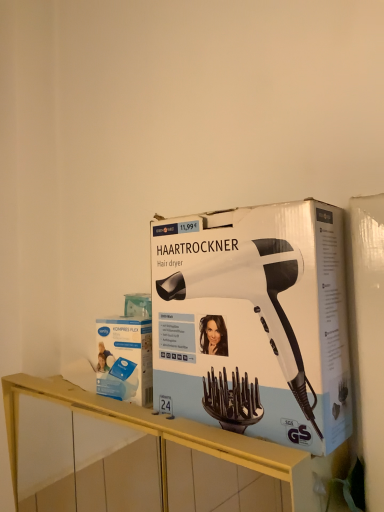
Question: Does yellow wood shelf at center touch white/black plastic hair dryer at center?

Choices:
 (A) yes
 (B) no

Answer: (B)

Question: Can we say yellow wood shelf at center lies outside white/black plastic hair dryer at center?

Choices:
 (A) no
 (B) yes

Answer: (B)

Question: Can you confirm if yellow wood shelf at center is positioned to the right of white/black plastic hair dryer at center?

Choices:
 (A) yes
 (B) no

Answer: (B)

Question: Is the depth of yellow wood shelf at center greater than that of white/black plastic hair dryer at center?

Choices:
 (A) yes
 (B) no

Answer: (B)

Question: Does yellow wood shelf at center have a greater height compared to white/black plastic hair dryer at center?

Choices:
 (A) no
 (B) yes

Answer: (B)

Question: Is white/black plastic hair dryer at center at the back of yellow wood shelf at center?

Choices:
 (A) no
 (B) yes

Answer: (A)

Question: Are white/black plastic hair dryer at center and yellow wood shelf at center far apart?

Choices:
 (A) yes
 (B) no

Answer: (B)

Question: From a real-world perspective, is white/black plastic hair dryer at center on yellow wood shelf at center?

Choices:
 (A) yes
 (B) no

Answer: (A)

Question: Does white/black plastic hair dryer at center have a lesser width compared to yellow wood shelf at center?

Choices:
 (A) yes
 (B) no

Answer: (A)

Question: Does white/black plastic hair dryer at center lie behind yellow wood shelf at center?

Choices:
 (A) yes
 (B) no

Answer: (A)

Question: Can you confirm if white/black plastic hair dryer at center is smaller than yellow wood shelf at center?

Choices:
 (A) no
 (B) yes

Answer: (B)

Question: From the image's perspective, would you say white/black plastic hair dryer at center is positioned over yellow wood shelf at center?

Choices:
 (A) no
 (B) yes

Answer: (B)

Question: Considering the relative sizes of white/black plastic hair dryer at center and blue cardboard box at center in the image provided, is white/black plastic hair dryer at center bigger than blue cardboard box at center?

Choices:
 (A) no
 (B) yes

Answer: (B)